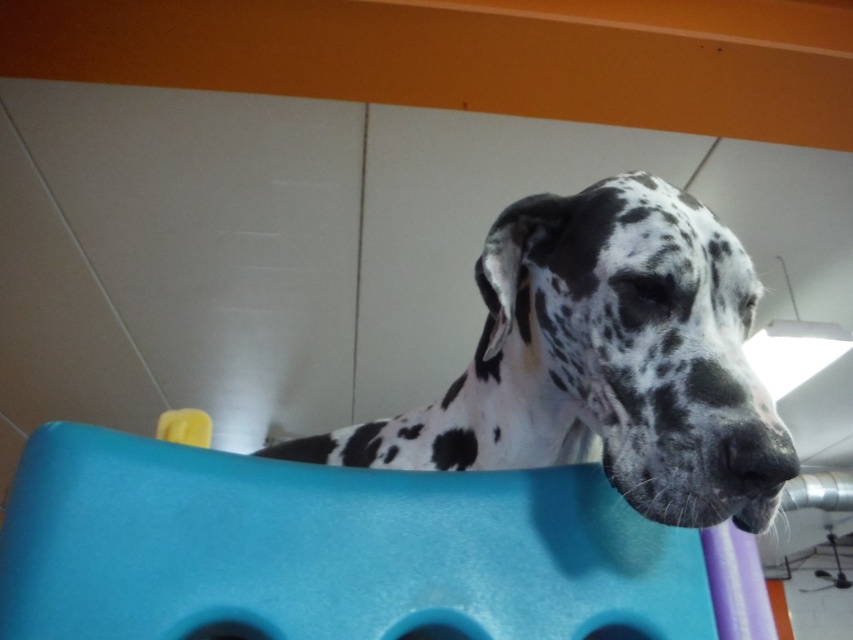
Question: Which point is closer to the camera?

Choices:
 (A) (112, 557)
 (B) (602, 429)

Answer: (A)

Question: Which point is farther to the camera?

Choices:
 (A) (630, 250)
 (B) (694, 589)

Answer: (A)

Question: Is blue plastic toy at center smaller than white-spotted fur dog at center?

Choices:
 (A) yes
 (B) no

Answer: (A)

Question: Among these objects, which one is nearest to the camera?

Choices:
 (A) blue plastic toy at center
 (B) white-spotted fur dog at center

Answer: (A)

Question: Can you confirm if blue plastic toy at center is positioned to the left of white-spotted fur dog at center?

Choices:
 (A) no
 (B) yes

Answer: (A)

Question: Is blue plastic toy at center below white-spotted fur dog at center?

Choices:
 (A) no
 (B) yes

Answer: (B)